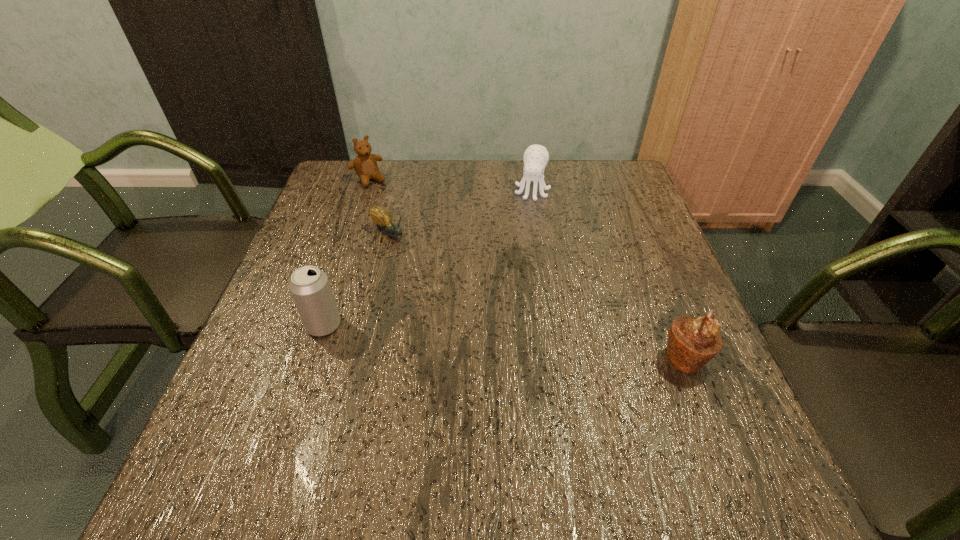
Find the location of a particular element. This screenshot has height=540, width=960. beer can is located at coordinates (309, 286).

Image resolution: width=960 pixels, height=540 pixels. What are the coordinates of `the rightmost object` in the screenshot? It's located at (692, 342).

At what (x,y) coordinates should I click in order to perform the action: click on muffin. Please return your answer as a coordinate pair (x, y). The height and width of the screenshot is (540, 960). Looking at the image, I should click on (692, 342).

You are a GUI agent. You are given a task and a screenshot of the screen. Output one action in this format:
    pyautogui.click(x=<x>, y=<y>)
    Task: Click on the escargot
    The height and width of the screenshot is (540, 960).
    Given the screenshot: What is the action you would take?
    pyautogui.click(x=381, y=216)

At what (x,y) coordinates should I click in order to perform the action: click on the shortest object. Please return your answer as a coordinate pair (x, y). Looking at the image, I should click on (381, 216).

Locate an element on the screen. octopus is located at coordinates (536, 157).

Identify the location of teddy bear. (365, 165).

This screenshot has width=960, height=540. I want to click on vacant space located 0.380m on the back of the beer can, so click(x=363, y=207).

This screenshot has width=960, height=540. Identify the location of free space located on the left of the rightmost object. (463, 358).

Find the location of a particular element. The width and height of the screenshot is (960, 540). vacant space located on the front-facing side of the shortest object is located at coordinates (433, 273).